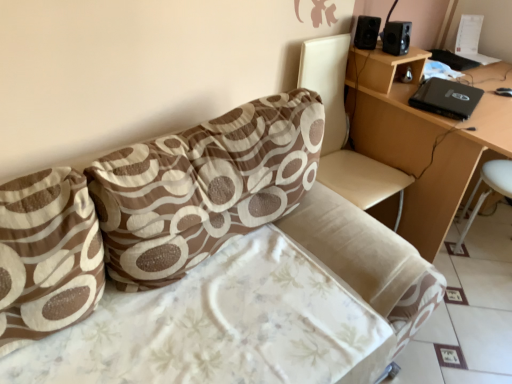
Question: Can you confirm if black matte speaker at upper right, which is the first speaker from left to right, is taller than light brown wooden table at upper right?

Choices:
 (A) no
 (B) yes

Answer: (A)

Question: Does black matte speaker at upper right, which is the 2th speaker in right-to-left order, have a lesser width compared to light brown wooden table at upper right?

Choices:
 (A) no
 (B) yes

Answer: (B)

Question: Is black matte speaker at upper right, which is the 2th speaker in right-to-left order, not close to light brown wooden table at upper right?

Choices:
 (A) no
 (B) yes

Answer: (A)

Question: Is light brown wooden table at upper right inside black matte speaker at upper right, which is the first speaker from left to right?

Choices:
 (A) yes
 (B) no

Answer: (B)

Question: Considering the relative positions of black matte speaker at upper right, which is the first speaker from left to right, and light brown wooden table at upper right in the image provided, is black matte speaker at upper right, which is the first speaker from left to right, to the left of light brown wooden table at upper right from the viewer's perspective?

Choices:
 (A) no
 (B) yes

Answer: (B)

Question: From a real-world perspective, is black matte laptop at upper right physically located above or below beige leather swivel chair at upper right?

Choices:
 (A) above
 (B) below

Answer: (A)

Question: In the image, is black matte laptop at upper right positioned in front of or behind beige leather swivel chair at upper right?

Choices:
 (A) front
 (B) behind

Answer: (B)

Question: Is point (428, 110) closer or farther from the camera than point (316, 64)?

Choices:
 (A) closer
 (B) farther

Answer: (B)

Question: Is black matte laptop at upper right situated inside beige leather swivel chair at upper right or outside?

Choices:
 (A) inside
 (B) outside

Answer: (B)

Question: Visually, is white plastic bar stool at lower right positioned to the left or to the right of black plastic speaker at upper right, which is the 1th speaker in right-to-left order?

Choices:
 (A) left
 (B) right

Answer: (B)

Question: In terms of size, does white plastic bar stool at lower right appear bigger or smaller than black plastic speaker at upper right, placed as the 2th speaker when sorted from left to right?

Choices:
 (A) small
 (B) big

Answer: (B)

Question: In the image, is white plastic bar stool at lower right positioned in front of or behind black plastic speaker at upper right, placed as the 2th speaker when sorted from left to right?

Choices:
 (A) behind
 (B) front

Answer: (B)

Question: In terms of height, does white plastic bar stool at lower right look taller or shorter compared to black plastic speaker at upper right, placed as the 2th speaker when sorted from left to right?

Choices:
 (A) short
 (B) tall

Answer: (B)

Question: From a real-world perspective, is black plastic speaker at upper right, which is the 1th speaker in right-to-left order, physically located above or below white plastic bar stool at lower right?

Choices:
 (A) above
 (B) below

Answer: (A)

Question: In the image, is black plastic speaker at upper right, which is the 1th speaker in right-to-left order, positioned in front of or behind white plastic bar stool at lower right?

Choices:
 (A) front
 (B) behind

Answer: (B)